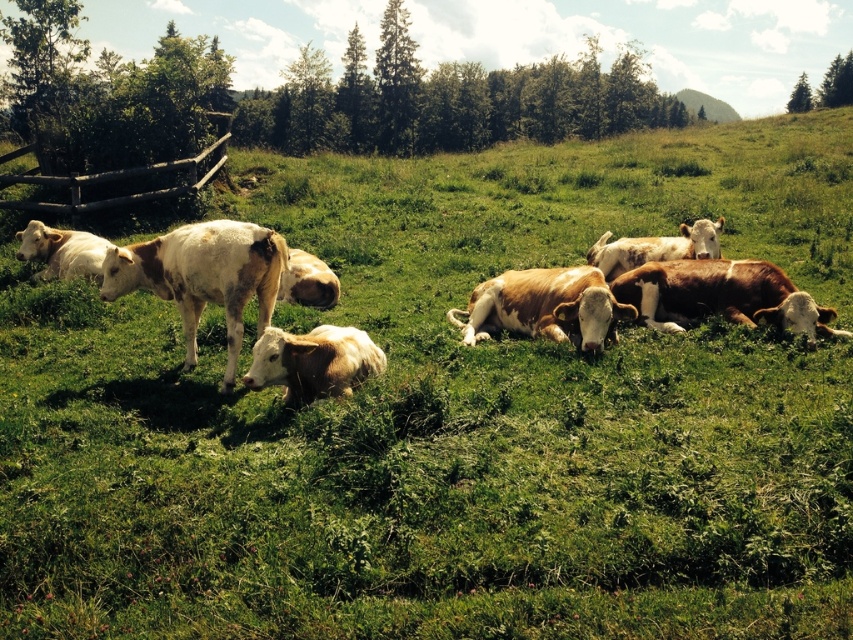
You are a farmer checking the location of your cows in the field. You know that the field is represented on a coordinate grid where the bottom left corner is the origin point. Can you determine the position of the brown speckled cow at center relative to the field?

The brown speckled cow at center is located at point (132, 264) on the coordinate grid, which means it is positioned approximately 41.4 percent from the left edge and 15.6 percent from the bottom edge of the field.

You are a farmer checking the pasture. You notice the brown speckled cow at center and the brown wooden fence at left. Which object appears larger in the image?

Result: The brown wooden fence at left appears larger than the brown speckled cow at center.

Consider the image. You are a farmer checking the pasture. You notice the brown speckled cow at center and the brown wooden fence at left. Which object is narrower in width?

The brown speckled cow at center is thinner than the brown wooden fence at left, so the cow is narrower in width.